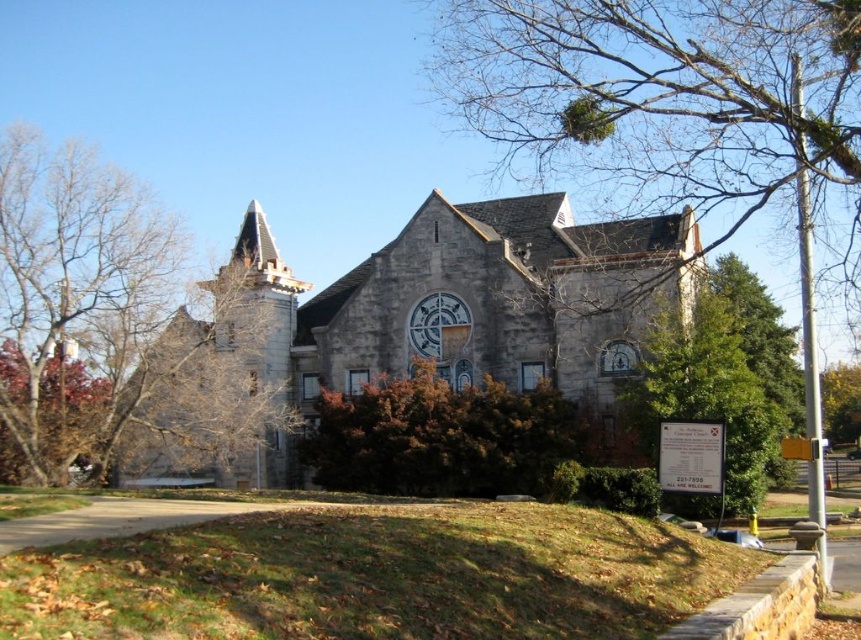
Question: Can you confirm if green leafy tree at upper right is wider than brown textured stone tower at upper left?

Choices:
 (A) no
 (B) yes

Answer: (B)

Question: Considering the relative positions of gray stone church at center and brown textured bush at center in the image provided, where is gray stone church at center located with respect to brown textured bush at center?

Choices:
 (A) left
 (B) right

Answer: (A)

Question: Which point is closer to the camera taking this photo?

Choices:
 (A) (394, 417)
 (B) (115, 328)
 (C) (671, 317)
 (D) (859, 371)

Answer: (C)

Question: Is brown textured bush at center in front of green leafy tree at right?

Choices:
 (A) no
 (B) yes

Answer: (A)

Question: Estimate the real-world distances between objects in this image. Which object is closer to the green leafy tree at right?

Choices:
 (A) stone clock at center
 (B) green leafy tree at upper right

Answer: (B)

Question: Among these points, which one is farthest from the camera?

Choices:
 (A) (633, 64)
 (B) (50, 483)

Answer: (A)